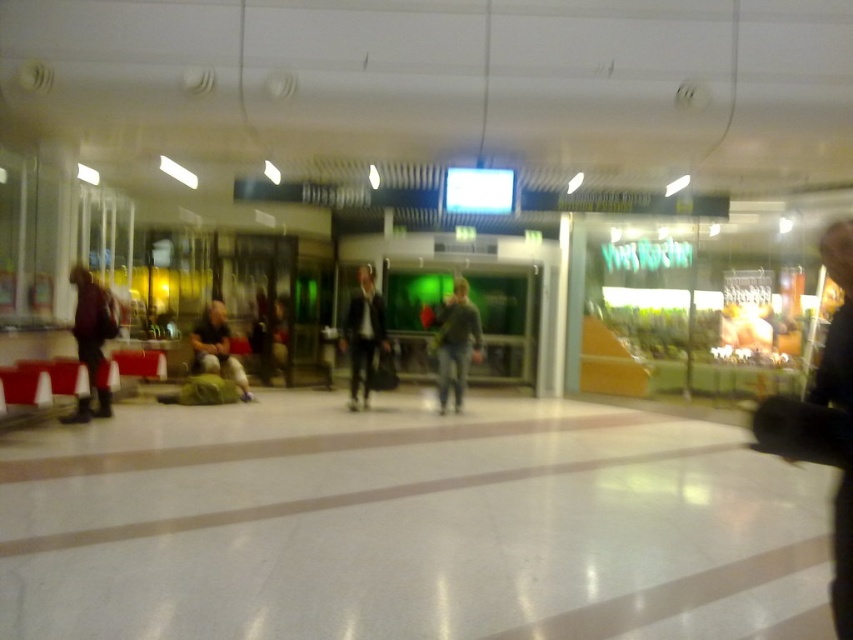
You are standing in the shopping mall and want to take a photo of the point at coordinates (831, 276). Your camera has a maximum focus range of 2 meters. Will the camera be able to focus on the point?

The point at coordinates (831, 276) is 2.10 meters away from the camera, which exceeds the maximum focus range of 2 meters. Therefore, the camera will not be able to focus on the point.

You are a person standing in the shopping mall and you see a dark gray sweater at center and a green fabric bag at center. Which item is located more to the right side?

The dark gray sweater at center is positioned on the right side of green fabric bag at center, so it is more to the right.

You are standing in the shopping mall and want to take a photo of both the point at [845,236] and the point at [361,326]. Which point should you focus on first to ensure both are in sharp focus?

You should focus on the point at [845,236] first because it is closer to the camera than the point at [361,326]. By focusing on the closer point, the farther point will also be within the depth of field and in focus.